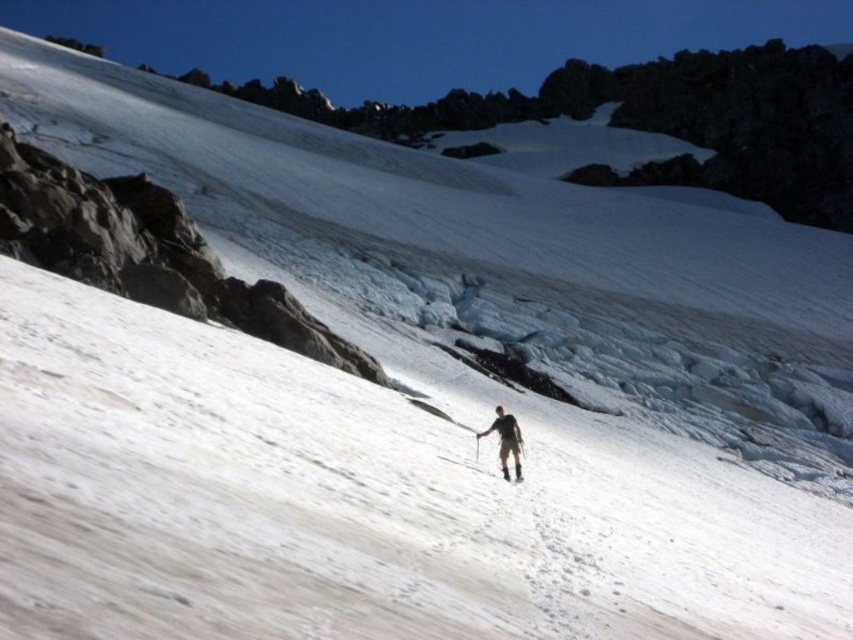
From the picture: You are a hiker trying to determine if your equipment is positioned correctly. Based on the scene, which object is taller between the light brown fabric pants at center and the white matte ski at center?

The light brown fabric pants at center is taller than the white matte ski at center according to the description.

You are a hiker trying to cross the snow. You have the light brown fabric pants at center and the white matte ski at center. Which item has a larger width?

The light brown fabric pants at center has a larger width than the white matte ski at center.

You are a photographer trying to capture the light brown fabric pants at center and the white matte ski at center in the same frame. Which object should you zoom in on to ensure both are clearly visible?

The light brown fabric pants at center is bigger than the white matte ski at center. To ensure both are clearly visible, you should zoom in on the smaller object, the white matte ski at center, so that the larger object, the light brown fabric pants at center, remains in frame and in focus.